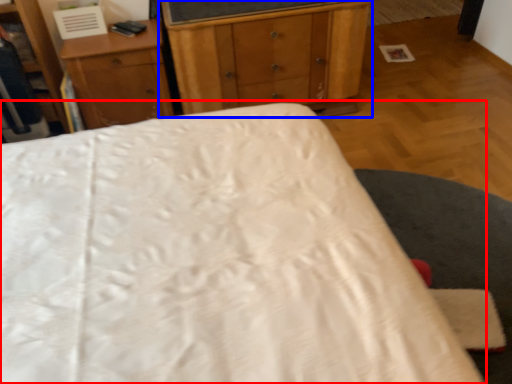
Question: Which point is closer to the camera, bed (highlighted by a red box) or chest of drawers (highlighted by a blue box)?

Choices:
 (A) bed
 (B) chest of drawers

Answer: (A)